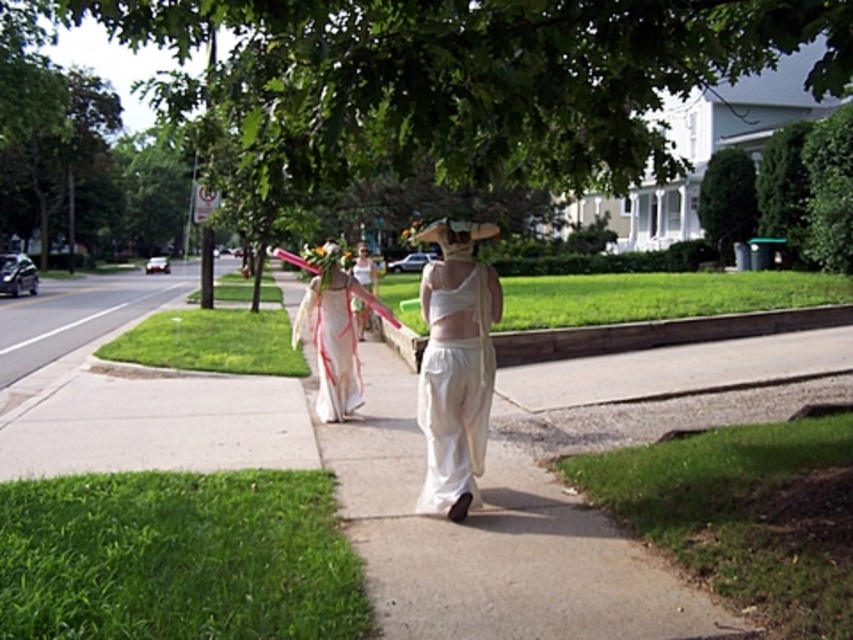
You are a photographer trying to capture a clear shot of the white sheer fabric dress at center without the green leafy tree at center blocking it. Based on their sizes, which object should you focus on first to ensure the dress is visible?

The green leafy tree at center is wider than the white sheer fabric dress at center. To ensure the dress is visible, focus on the white sheer fabric dress at center first before the tree obstructs the view.

You are standing at the origin point of the coordinate system in the street scene. The white sheer fabric dress at center is located at coordinates approximately 0.616 on the x axis and 0.533 on the y axis. If you want to walk directly towards the dress, in which direction should you move?

To reach the white sheer fabric dress at center located at coordinates approximately 0.616 on the x axis and 0.533 on the y axis, you should move northeast since the x coordinate is greater than 0.5 and the y coordinate is also greater than 0.5.